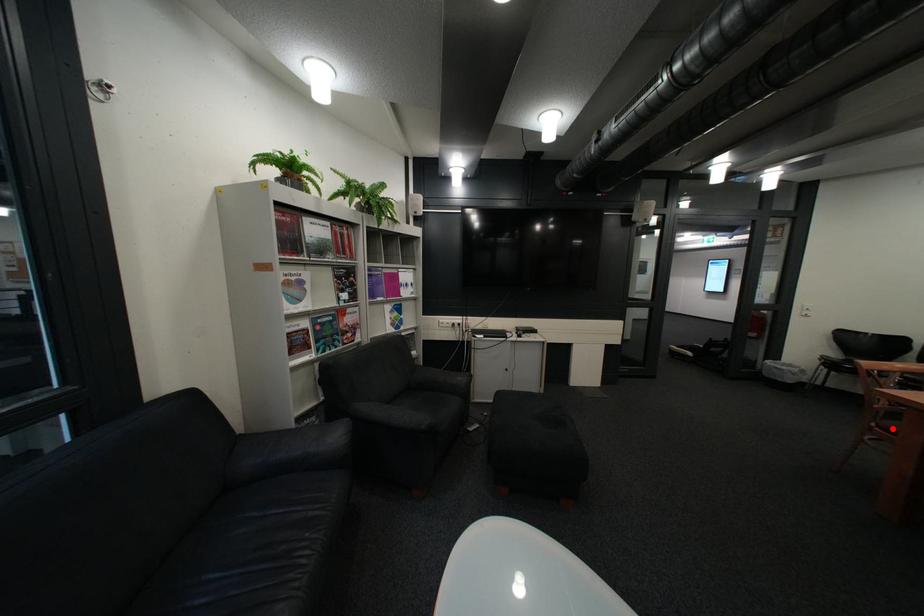
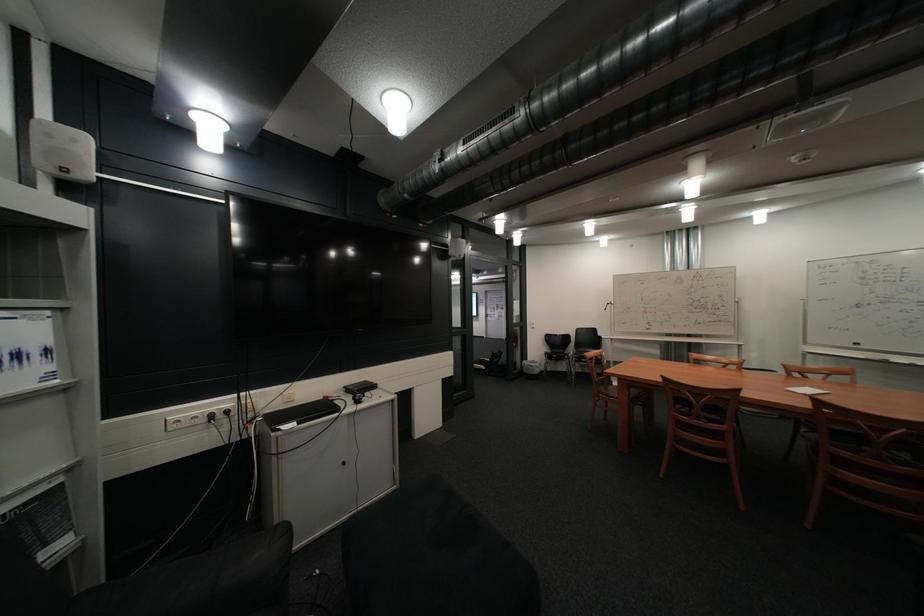
Question: I am providing you with two images of the same scene from different viewpoints. Image1 has a red point marked. In image2, the corresponding 3D location appears at what relative position? Reply with the corresponding letter.

Choices:
 (A) Closer
 (B) Farther

Answer: (A)